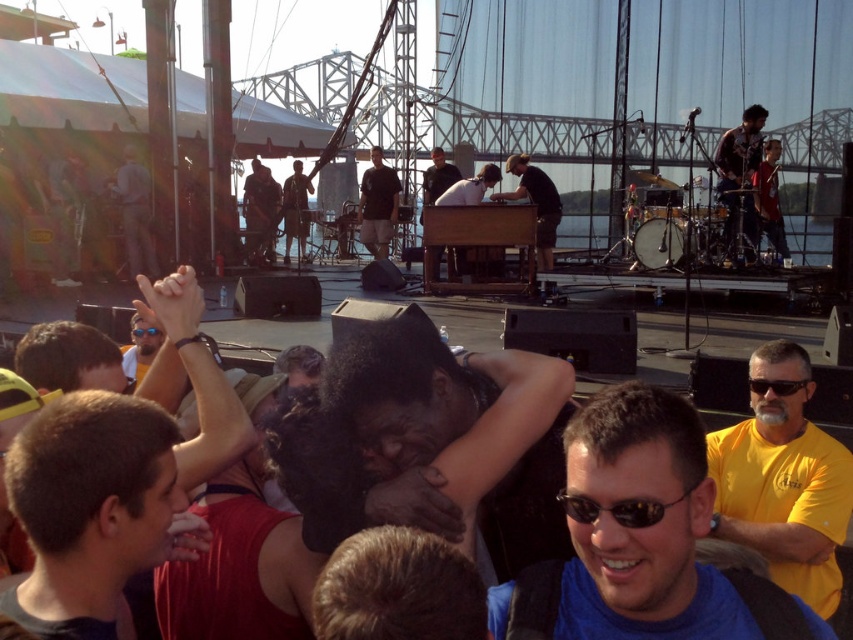
You are a photographer at the concert and want to capture both the matte black shirt at center and the blue plastic goggles at upper center in a single frame. Which object should you focus on first to ensure both are in focus?

The matte black shirt at center has a lesser height compared to blue plastic goggles at upper center, so you should focus on the blue plastic goggles at upper center first to ensure both are in focus.

You are a stagehand setting up for the concert. You notice the matte black guitar at left and the blue plastic goggles at upper center. Which object is placed higher in the scene?

The matte black guitar at left is positioned over the blue plastic goggles at upper center, so it is placed higher in the scene.